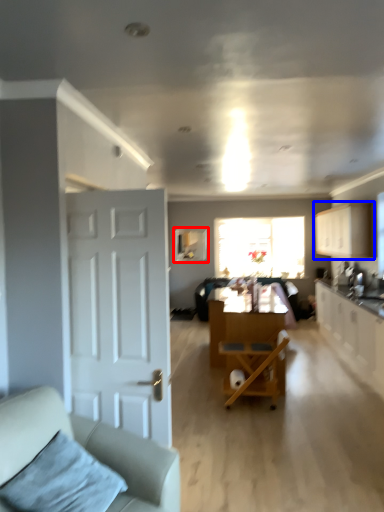
Question: Among these objects, which one is farthest to the camera, window screen (highlighted by a red box) or cabinetry (highlighted by a blue box)?

Choices:
 (A) window screen
 (B) cabinetry

Answer: (A)